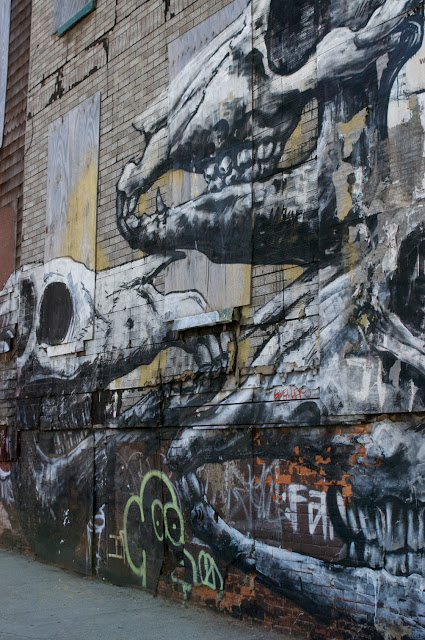
The width and height of the screenshot is (425, 640). Find the location of `board`. board is located at coordinates (73, 154).